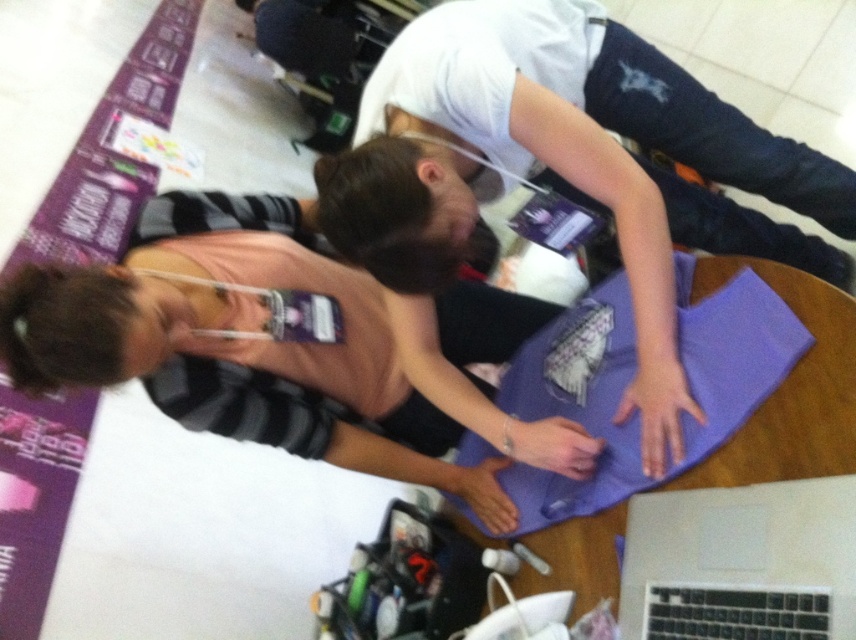
You are standing at the table in the image and want to place a small item between the two points labeled point (61, 266) and point (750, 296). Based on their positions, which point should you place the item closer to in order for it to be in front of both points?

The item should be placed closer to point (750, 296) because it is in front of point (61, 266). Placing it closer to the front point ensures it is in front of both.

You are standing in front of the table and want to reach both the point at (x=590, y=428) and the point at (x=776, y=499). Which point should you reach for first to minimize the distance you have to move?

You should reach for point (x=590, y=428) first because it is closer to you than point (x=776, y=499).

You are a photographer standing behind the two people at the table. You need to take a photo that includes both the pink fabric at center and the silver metallic laptop at lower right. Based on their heights, which object will appear larger in the photo?

The pink fabric at center will appear larger in the photo because it is much taller than the silver metallic laptop at lower right.